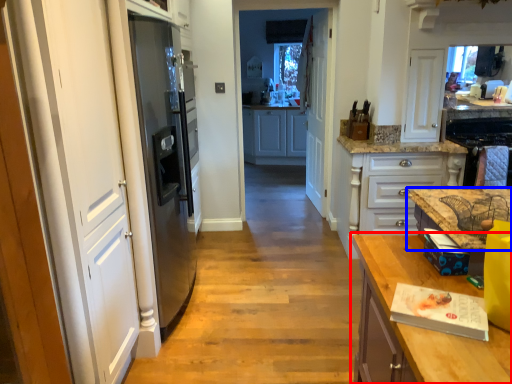
Question: Which object is further to the camera taking this photo, countertop (highlighted by a red box) or countertop (highlighted by a blue box)?

Choices:
 (A) countertop
 (B) countertop

Answer: (B)